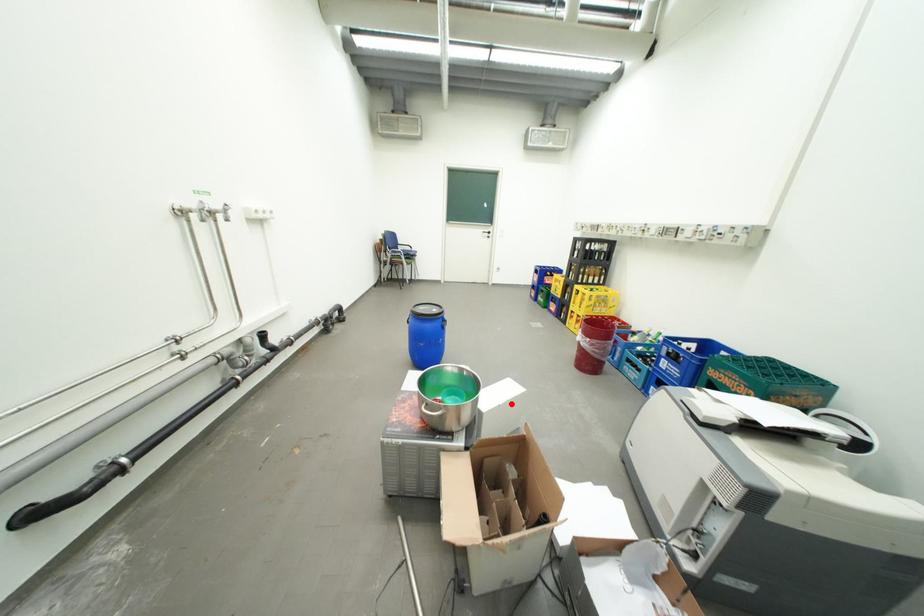
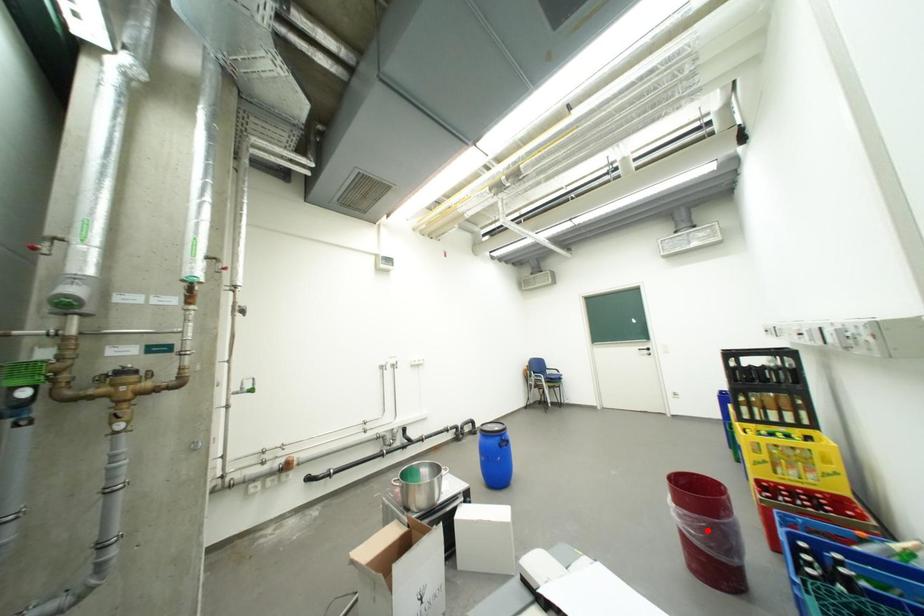
I am providing you with two images of the same scene from different viewpoints. A red point is marked on the first image and another point is marked on the second image. Does the point marked in image1 correspond to the same location as the one in image2?

No